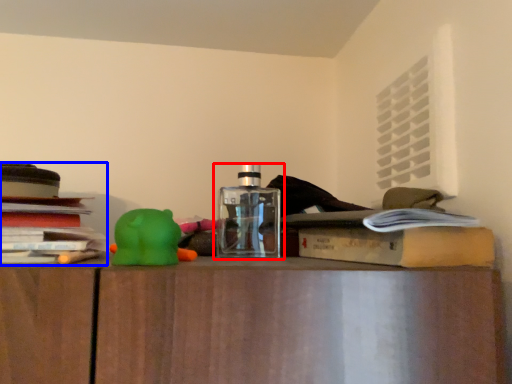
Question: Which of the following is the closest to the observer, bottle (highlighted by a red box) or book (highlighted by a blue box)?

Choices:
 (A) bottle
 (B) book

Answer: (B)